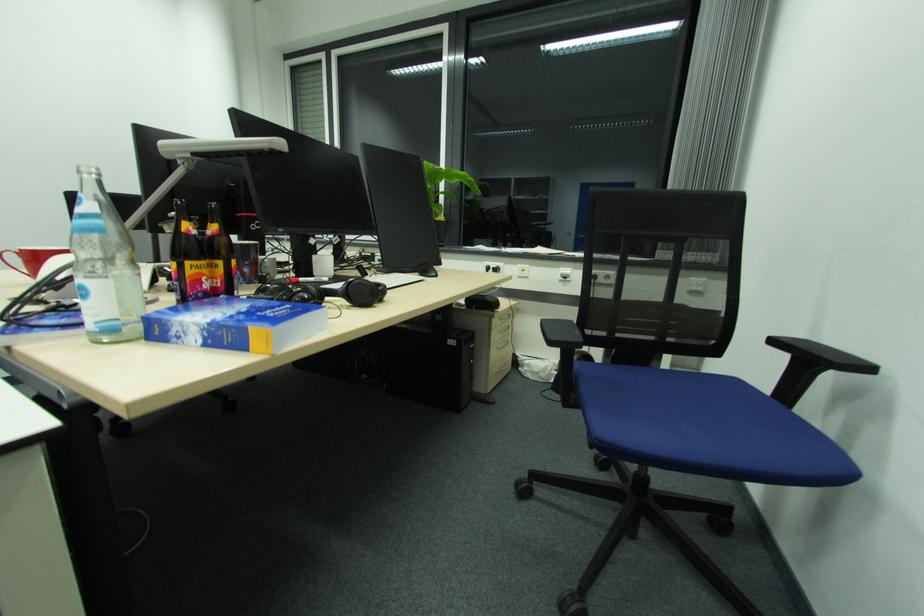
Which object does [324,292] point to?

This point indicates the black headphones.